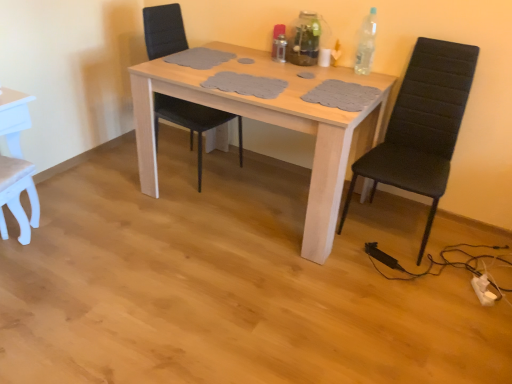
You are a GUI agent. You are given a task and a screenshot of the screen. Output one action in this format:
    pyautogui.click(x=<x>, y=<y>)
    Task: Click on the light wood table at center
    This screenshot has width=512, height=384.
    Given the screenshot: What is the action you would take?
    pyautogui.click(x=272, y=124)

This screenshot has height=384, width=512. What do you see at coordinates (272, 124) in the screenshot?
I see `light wood table at center` at bounding box center [272, 124].

Describe the element at coordinates (16, 195) in the screenshot. I see `white matte chair at lower left, which ranks as the first chair in left-to-right order` at that location.

Locate an element on the screen. This screenshot has height=384, width=512. clear plastic bottle at upper right, the 3th bottle viewed from the left is located at coordinates (366, 44).

Find the location of `black fabric chair at right, marked as the 1th chair in a right-to-left arrangement`. black fabric chair at right, marked as the 1th chair in a right-to-left arrangement is located at coordinates (422, 126).

Is white matte chair at lower left, which is the third chair in right-to-left order, in contact with black leather chair at center, acting as the second chair starting from the right?

white matte chair at lower left, which is the third chair in right-to-left order, and black leather chair at center, acting as the second chair starting from the right, are clearly separated.

Is the position of white matte chair at lower left, which ranks as the first chair in left-to-right order, less distant than that of black leather chair at center, acting as the second chair starting from the right?

Yes, it is in front of black leather chair at center, acting as the second chair starting from the right.

The width and height of the screenshot is (512, 384). I want to click on chair that is the 2nd one when counting upward from the white matte chair at lower left, which ranks as the first chair in left-to-right order (from the image's perspective), so click(x=193, y=122).

Considering the positions of objects white matte chair at lower left, which is the third chair in right-to-left order, and black leather chair at center, which appears as the second chair when viewed from the left, in the image provided, who is more to the right, white matte chair at lower left, which is the third chair in right-to-left order, or black leather chair at center, which appears as the second chair when viewed from the left,?

black leather chair at center, which appears as the second chair when viewed from the left.

In order to click on chair that is the 2nd one when counting downward from the clear plastic bottle at upper right, the 1th bottle viewed from the right (from the image's perspective) in this screenshot , I will do `click(422, 126)`.

Can you confirm if black fabric chair at right, marked as the 3th chair in a left-to-right arrangement, is taller than clear plastic bottle at upper right, the 3th bottle viewed from the left?

Yes, black fabric chair at right, marked as the 3th chair in a left-to-right arrangement, is taller than clear plastic bottle at upper right, the 3th bottle viewed from the left.

Do you think black fabric chair at right, marked as the 3th chair in a left-to-right arrangement, is within clear plastic bottle at upper right, the 3th bottle viewed from the left, or outside of it?

black fabric chair at right, marked as the 3th chair in a left-to-right arrangement, is not inside clear plastic bottle at upper right, the 3th bottle viewed from the left, it's outside.

How different are the orientations of black fabric chair at right, marked as the 1th chair in a right-to-left arrangement, and clear plastic bottle at upper right, the 1th bottle viewed from the right, in degrees?

1.73 degrees.

From the picture: In the image, is light wood table at center on the left side or the right side of transparent glass vase at upper center, the 2th bottle in the left-to-right sequence?

From the image, it's evident that light wood table at center is to the left of transparent glass vase at upper center, the 2th bottle in the left-to-right sequence.

Relative to transparent glass vase at upper center, the 2th bottle in the left-to-right sequence, is light wood table at center in front or behind?

light wood table at center is positioned closer to the viewer than transparent glass vase at upper center, the 2th bottle in the left-to-right sequence.

From a real-world perspective, is light wood table at center on transparent glass vase at upper center, the 2th bottle in the left-to-right sequence?

No, from a real-world perspective, light wood table at center is not on top of transparent glass vase at upper center, the 2th bottle in the left-to-right sequence.

Considering the relative positions of metallic silver bottle at upper center, arranged as the third bottle when viewed from the right, and light wood table at center in the image provided, is metallic silver bottle at upper center, arranged as the third bottle when viewed from the right, to the left or to the right of light wood table at center?

In the image, metallic silver bottle at upper center, arranged as the third bottle when viewed from the right, appears on the right side of light wood table at center.

Could light wood table at center be considered to be inside metallic silver bottle at upper center, arranged as the third bottle when viewed from the right?

Definitely not — light wood table at center is not inside metallic silver bottle at upper center, arranged as the third bottle when viewed from the right.

Which is behind, point (280, 59) or point (170, 91)?

The point (280, 59) is behind.

Is metallic silver bottle at upper center, the 1th bottle positioned from the left, facing away from light wood table at center?

metallic silver bottle at upper center, the 1th bottle positioned from the left, is not turned away from light wood table at center.

Is black fabric chair at right, marked as the 1th chair in a right-to-left arrangement, spatially inside black leather chair at center, acting as the second chair starting from the right, or outside of it?

black fabric chair at right, marked as the 1th chair in a right-to-left arrangement, exists outside the volume of black leather chair at center, acting as the second chair starting from the right.

Is black fabric chair at right, marked as the 3th chair in a left-to-right arrangement, positioned behind black leather chair at center, which appears as the second chair when viewed from the left?

No, the depth of black fabric chair at right, marked as the 3th chair in a left-to-right arrangement, is less than that of black leather chair at center, which appears as the second chair when viewed from the left.

How far apart are black fabric chair at right, marked as the 3th chair in a left-to-right arrangement, and black leather chair at center, acting as the second chair starting from the right?

black fabric chair at right, marked as the 3th chair in a left-to-right arrangement, and black leather chair at center, acting as the second chair starting from the right, are 3.68 feet apart.

Locate an element on the screen. This screenshot has width=512, height=384. chair lying above the black fabric chair at right, marked as the 1th chair in a right-to-left arrangement (from the image's perspective) is located at coordinates (193, 122).

Find the location of a particular element. chair that is the 1st object above the light wood table at center (from a real-world perspective) is located at coordinates (422, 126).

Is black fabric chair at right, marked as the 3th chair in a left-to-right arrangement, positioned beyond the bounds of light wood table at center?

Absolutely, black fabric chair at right, marked as the 3th chair in a left-to-right arrangement, is external to light wood table at center.

Is black fabric chair at right, marked as the 1th chair in a right-to-left arrangement, next to light wood table at center?

black fabric chair at right, marked as the 1th chair in a right-to-left arrangement, and light wood table at center are not in contact.

How far apart are transparent glass vase at upper center, arranged as the 2th bottle when viewed from the right, and white matte chair at lower left, which is the third chair in right-to-left order?

A distance of 5.33 feet exists between transparent glass vase at upper center, arranged as the 2th bottle when viewed from the right, and white matte chair at lower left, which is the third chair in right-to-left order.

Based on the photo, from a real-world perspective, relative to white matte chair at lower left, which is the third chair in right-to-left order, is transparent glass vase at upper center, the 2th bottle in the left-to-right sequence, vertically above or below?

In terms of real-world spatial position, transparent glass vase at upper center, the 2th bottle in the left-to-right sequence, is above white matte chair at lower left, which is the third chair in right-to-left order.

Which of these two, transparent glass vase at upper center, the 2th bottle in the left-to-right sequence, or white matte chair at lower left, which ranks as the first chair in left-to-right order, is thinner?

transparent glass vase at upper center, the 2th bottle in the left-to-right sequence.

Does transparent glass vase at upper center, the 2th bottle in the left-to-right sequence, have a greater height compared to white matte chair at lower left, which ranks as the first chair in left-to-right order?

No.

The width and height of the screenshot is (512, 384). Find the location of `chair that is the 2nd one below the black leather chair at center, which appears as the second chair when viewed from the left (from a real-world perspective)`. chair that is the 2nd one below the black leather chair at center, which appears as the second chair when viewed from the left (from a real-world perspective) is located at coordinates pos(16,195).

Which bottle is the 1st one when counting from the back of the black fabric chair at right, marked as the 3th chair in a left-to-right arrangement? Please provide its 2D coordinates.

[(366, 44)]

Based on their spatial positions, is clear plastic bottle at upper right, the 3th bottle viewed from the left, or light wood table at center further from black leather chair at center, which appears as the second chair when viewed from the left?

Among the two, clear plastic bottle at upper right, the 3th bottle viewed from the left, is located further to black leather chair at center, which appears as the second chair when viewed from the left.

Which object lies further to the anchor point black leather chair at center, acting as the second chair starting from the right, transparent glass vase at upper center, the 2th bottle in the left-to-right sequence, or metallic silver bottle at upper center, the 1th bottle positioned from the left?

transparent glass vase at upper center, the 2th bottle in the left-to-right sequence, lies further to black leather chair at center, acting as the second chair starting from the right, than the other object.

From the image, which object appears to be farther from black fabric chair at right, marked as the 1th chair in a right-to-left arrangement, light wood table at center or black leather chair at center, which appears as the second chair when viewed from the left?

black leather chair at center, which appears as the second chair when viewed from the left.

Based on their spatial positions, is transparent glass vase at upper center, arranged as the 2th bottle when viewed from the right, or black leather chair at center, acting as the second chair starting from the right, closer to clear plastic bottle at upper right, the 3th bottle viewed from the left?

transparent glass vase at upper center, arranged as the 2th bottle when viewed from the right, lies closer to clear plastic bottle at upper right, the 3th bottle viewed from the left, than the other object.

From the picture: Looking at the image, which one is located further to white matte chair at lower left, which ranks as the first chair in left-to-right order, black fabric chair at right, marked as the 3th chair in a left-to-right arrangement, or black leather chair at center, acting as the second chair starting from the right?

black fabric chair at right, marked as the 3th chair in a left-to-right arrangement, is positioned further to the anchor white matte chair at lower left, which ranks as the first chair in left-to-right order.

Which object lies further to the anchor point clear plastic bottle at upper right, the 3th bottle viewed from the left, black fabric chair at right, marked as the 1th chair in a right-to-left arrangement, or light wood table at center?

The object further to clear plastic bottle at upper right, the 3th bottle viewed from the left, is light wood table at center.

Based on the photo, from the image, which object appears to be farther from white matte chair at lower left, which ranks as the first chair in left-to-right order, metallic silver bottle at upper center, arranged as the third bottle when viewed from the right, or black fabric chair at right, marked as the 3th chair in a left-to-right arrangement?

black fabric chair at right, marked as the 3th chair in a left-to-right arrangement.

Looking at the image, which one is located closer to black leather chair at center, which appears as the second chair when viewed from the left, black fabric chair at right, marked as the 1th chair in a right-to-left arrangement, or metallic silver bottle at upper center, the 1th bottle positioned from the left?

metallic silver bottle at upper center, the 1th bottle positioned from the left, is closer to black leather chair at center, which appears as the second chair when viewed from the left.

Where is `table between white matte chair at lower left, which ranks as the first chair in left-to-right order, and black fabric chair at right, marked as the 3th chair in a left-to-right arrangement, from left to right`? table between white matte chair at lower left, which ranks as the first chair in left-to-right order, and black fabric chair at right, marked as the 3th chair in a left-to-right arrangement, from left to right is located at coordinates (272, 124).

At what (x,y) coordinates should I click in order to perform the action: click on table between white matte chair at lower left, which ranks as the first chair in left-to-right order, and transparent glass vase at upper center, arranged as the 2th bottle when viewed from the right, in the horizontal direction. Please return your answer as a coordinate pair (x, y). This screenshot has height=384, width=512. Looking at the image, I should click on pyautogui.click(x=272, y=124).

Where is `table located between white matte chair at lower left, which ranks as the first chair in left-to-right order, and clear plastic bottle at upper right, the 1th bottle viewed from the right, in the left-right direction`? The image size is (512, 384). table located between white matte chair at lower left, which ranks as the first chair in left-to-right order, and clear plastic bottle at upper right, the 1th bottle viewed from the right, in the left-right direction is located at coordinates (272, 124).

Where is `bottle between metallic silver bottle at upper center, arranged as the third bottle when viewed from the right, and clear plastic bottle at upper right, the 3th bottle viewed from the left, from left to right`? Image resolution: width=512 pixels, height=384 pixels. bottle between metallic silver bottle at upper center, arranged as the third bottle when viewed from the right, and clear plastic bottle at upper right, the 3th bottle viewed from the left, from left to right is located at coordinates (304, 40).